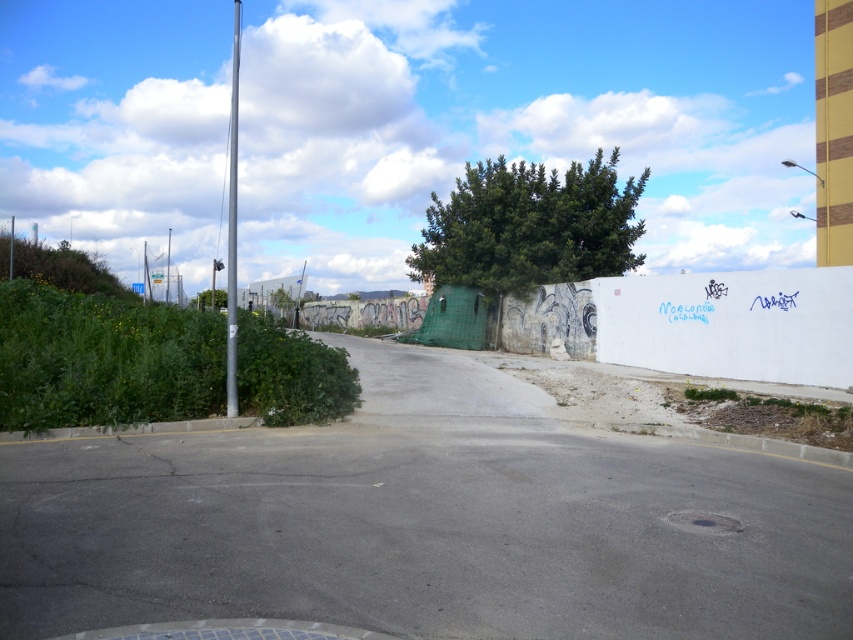
Who is more forward, [231,346] or [201,298]?

Point [231,346] is in front.

Does silver metallic pole at left have a greater width compared to green leafy tree at left?

Indeed, silver metallic pole at left has a greater width compared to green leafy tree at left.

Describe the element at coordinates (231, 225) in the screenshot. Image resolution: width=853 pixels, height=640 pixels. I see `silver metallic pole at left` at that location.

Where is `silver metallic pole at left`? The image size is (853, 640). silver metallic pole at left is located at coordinates (231, 225).

Is silver metallic pole at left smaller than blue plastic sign at upper left?

Incorrect, silver metallic pole at left is not smaller in size than blue plastic sign at upper left.

Where is `silver metallic pole at left`? silver metallic pole at left is located at coordinates (231, 225).

Identify the location of silver metallic pole at left. (231, 225).

Does green leafy tree at left have a larger size compared to silver metallic pole at upper left?

No.

Locate an element on the screen. The image size is (853, 640). green leafy tree at left is located at coordinates (212, 298).